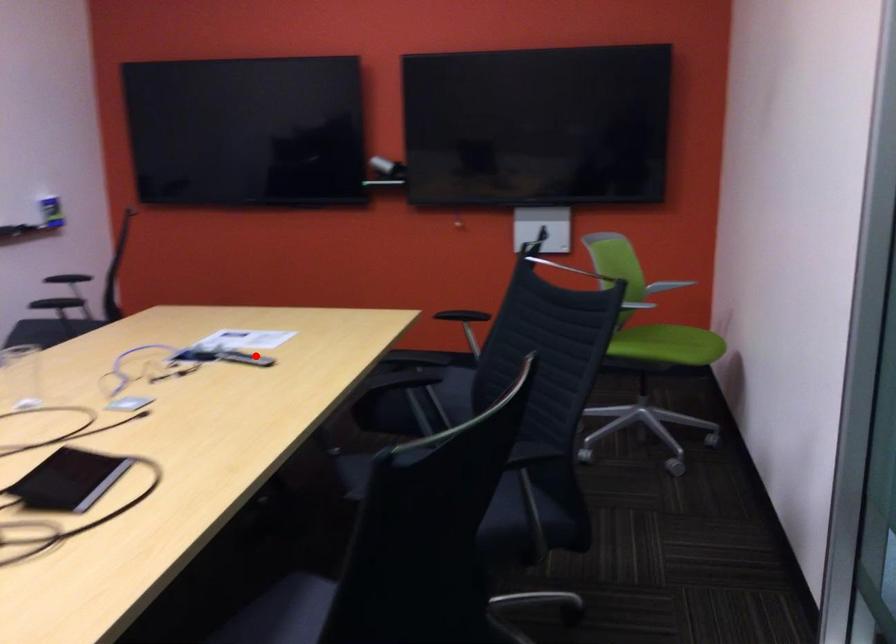
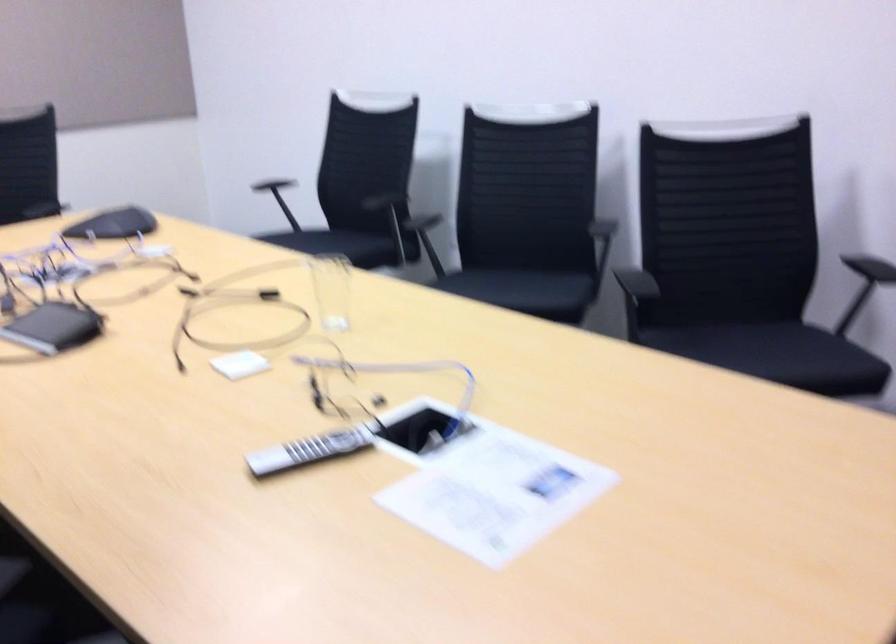
Question: A red point is marked in image1. In image2, is the corresponding 3D point closer to the camera or farther? Reply with the corresponding letter.

Choices:
 (A) The corresponding 3D point is closer.
 (B) The corresponding 3D point is farther.

Answer: (A)